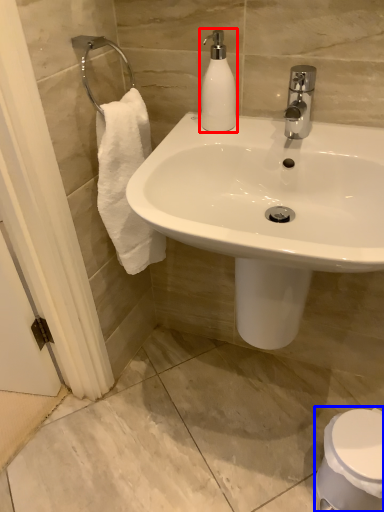
Question: Which point is further to the camera, soap dispenser (highlighted by a red box) or toilet (highlighted by a blue box)?

Choices:
 (A) soap dispenser
 (B) toilet

Answer: (B)